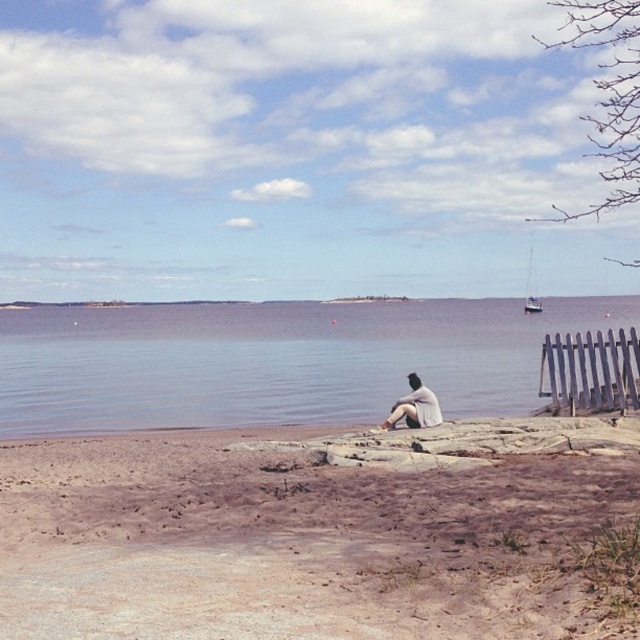
Question: Which object is the farthest from the gray wooden fence at lower right?

Choices:
 (A) blue water at center
 (B) white cotton shirt at lower center

Answer: (A)

Question: Is gray wooden fence at lower right positioned behind white glossy sailboat at right?

Choices:
 (A) yes
 (B) no

Answer: (B)

Question: Can you confirm if blue water at center is positioned to the left of white glossy sailboat at right?

Choices:
 (A) yes
 (B) no

Answer: (A)

Question: Considering the real-world distances, which object is farthest from the blue water at center?

Choices:
 (A) brown sandy beach at lower center
 (B) white cotton shirt at lower center
 (C) white glossy sailboat at right
 (D) gray wooden fence at lower right

Answer: (B)

Question: Which point appears closest to the camera in this image?

Choices:
 (A) (60, 609)
 (B) (193, 336)

Answer: (A)

Question: Is gray wooden fence at lower right thinner than white glossy sailboat at right?

Choices:
 (A) yes
 (B) no

Answer: (A)